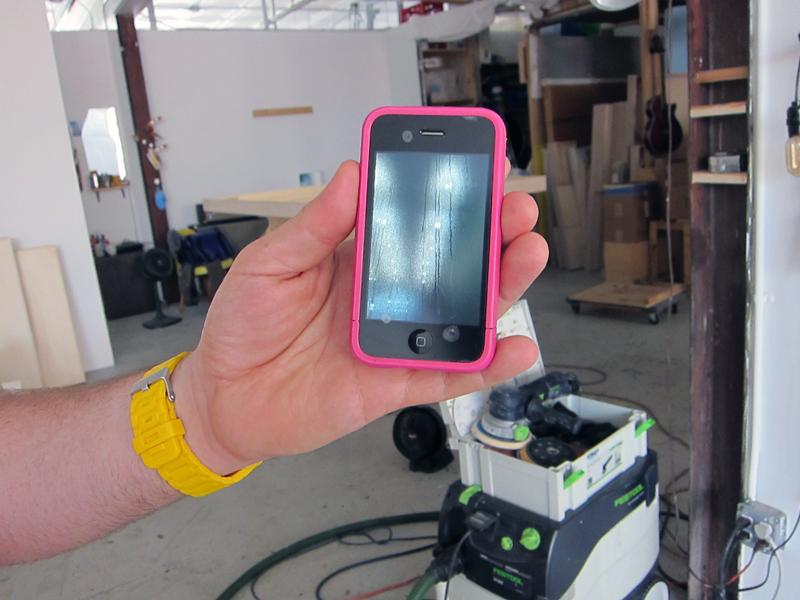
The image size is (800, 600). Identify the location of electrical outlet. (762, 509).